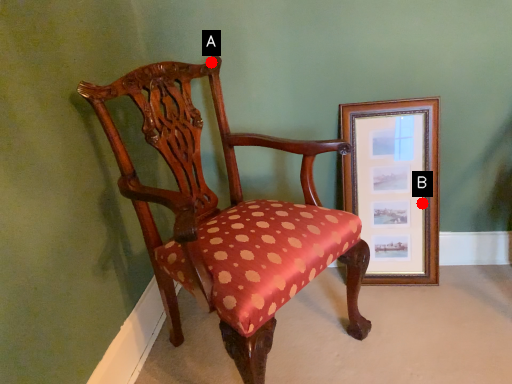
Question: Two points are circled on the image, labeled by A and B beside each circle. Which point is closer to the camera taking this photo?

Choices:
 (A) A is closer
 (B) B is closer

Answer: (A)